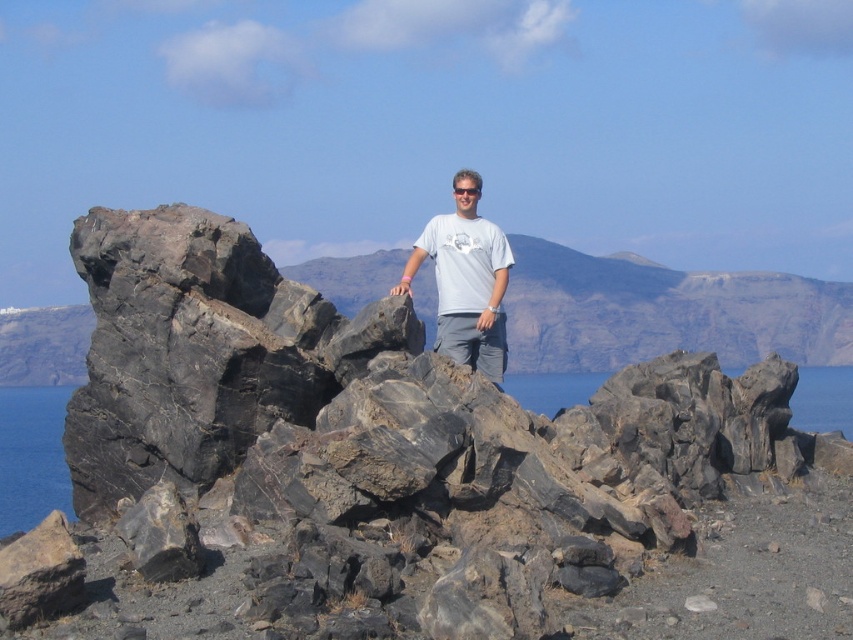
You are navigating a drone over the rocky outcrop by the sea. The drone needs to land precisely on the black rock at center. Given the coordinates provided in the description, can you confirm the exact position where the drone should land?

The black rock at center is located at point (32,456), so the drone should land at those coordinates to reach the black rock at center accurately.

You are a photographer planning to take a picture of the black rock at center and the transparent water at rock right. Based on their positions, which object should you focus on first if you want to capture both in a single frame without moving the camera?

The black rock at center should be focused on first since it is positioned to the left of the transparent water at rock right, allowing both to be captured in the frame by centering the camera between them.